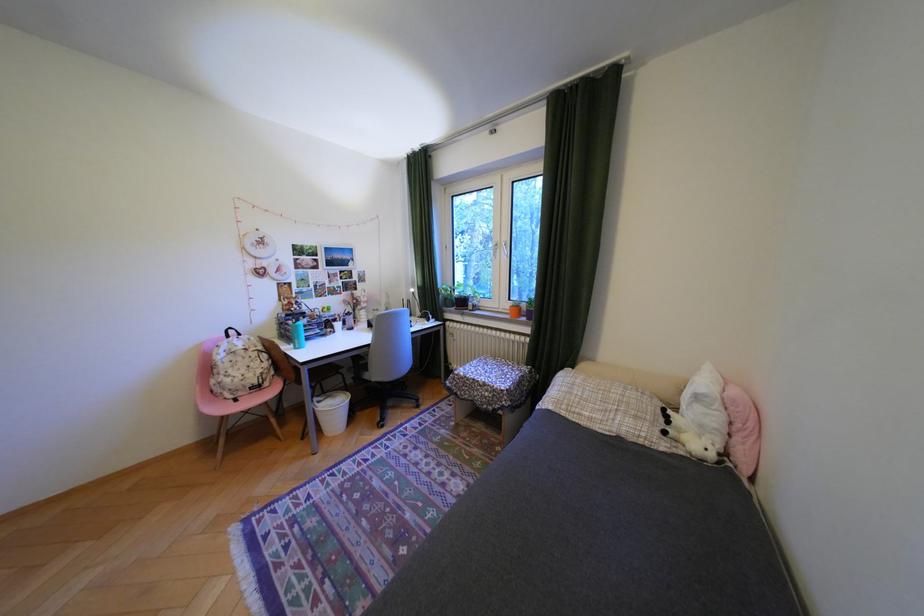
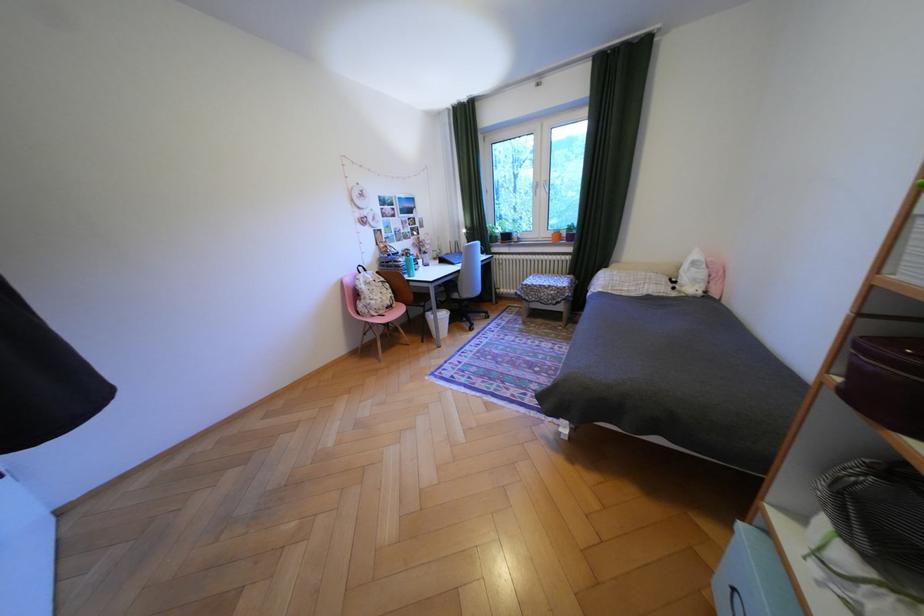
In the second image, find the point that corresponds to (x=251, y=394) in the first image.

(393, 312)